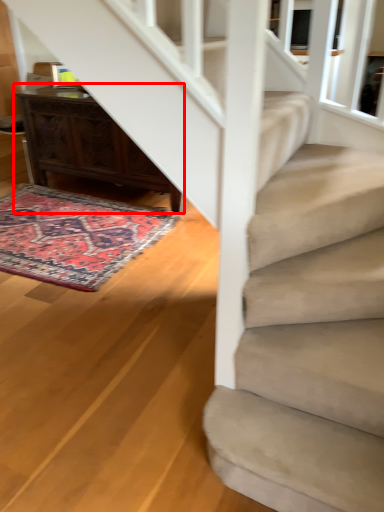
Question: From the image, what is the correct spatial relationship of desk (annotated by the red box) in relation to mat?

Choices:
 (A) right
 (B) left

Answer: (A)